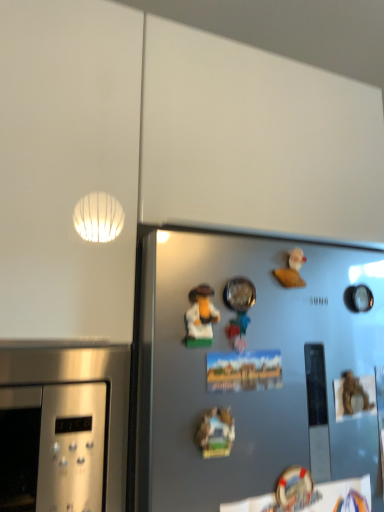
Question: From a real-world perspective, is matte plastic toy at center, which appears as the second art when ordered from the bottom, physically located above or below white matte rubber duck at upper right, which appears as the 2th toy when viewed from the left?

Choices:
 (A) below
 (B) above

Answer: (A)

Question: Choose the correct answer: Is matte plastic toy at center, marked as the first art in a top-to-bottom arrangement, inside white matte rubber duck at upper right, which appears as the 2th toy when viewed from the left, or outside it?

Choices:
 (A) inside
 (B) outside

Answer: (B)

Question: Which is nearer to the white matte rubber duck at upper right, positioned as the first toy in right-to-left order?

Choices:
 (A) wooden miniature house at center, which is the 2th art from top to bottom
 (B) matte plastic toy at center, marked as the first art in a top-to-bottom arrangement
 (C) metallic silver bowl at center, the first toy when ordered from left to right

Answer: (C)

Question: Which object is the farthest from the matte plastic toy at center, marked as the first art in a top-to-bottom arrangement?

Choices:
 (A) white matte rubber duck at upper right, the first toy viewed from the back
 (B) wooden miniature house at center, the 1th art ordered from the bottom
 (C) metallic silver bowl at center, the first toy when ordered from left to right

Answer: (A)